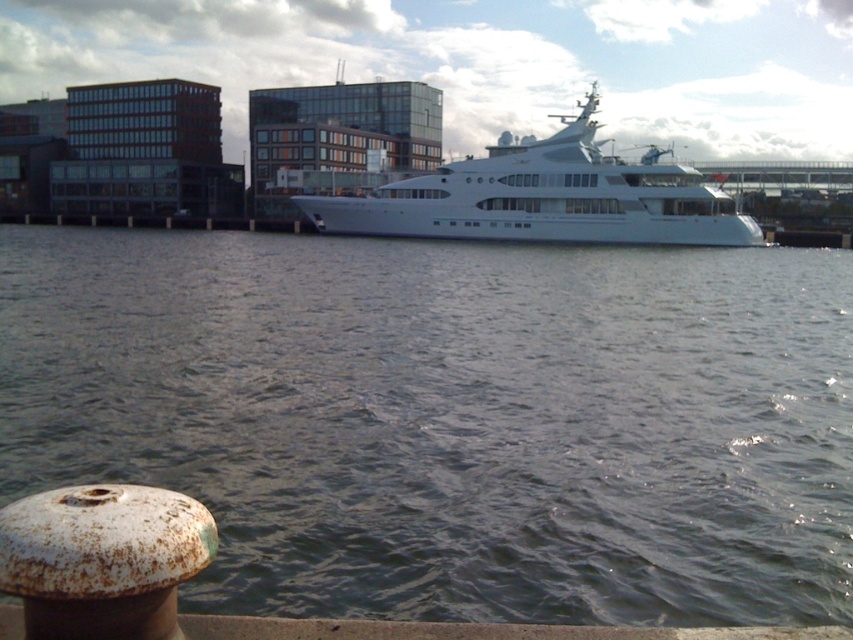
Question: Which object is closer to the camera taking this photo?

Choices:
 (A) clear water at center
 (B) white glossy cruise ship at center

Answer: (A)

Question: Which of the following is the farthest from the observer?

Choices:
 (A) white glossy cruise ship at center
 (B) clear water at center

Answer: (A)

Question: Is clear water at center positioned before white glossy cruise ship at center?

Choices:
 (A) no
 (B) yes

Answer: (B)

Question: Does clear water at center have a greater width compared to white glossy cruise ship at center?

Choices:
 (A) no
 (B) yes

Answer: (B)

Question: Is clear water at center thinner than white glossy cruise ship at center?

Choices:
 (A) no
 (B) yes

Answer: (A)